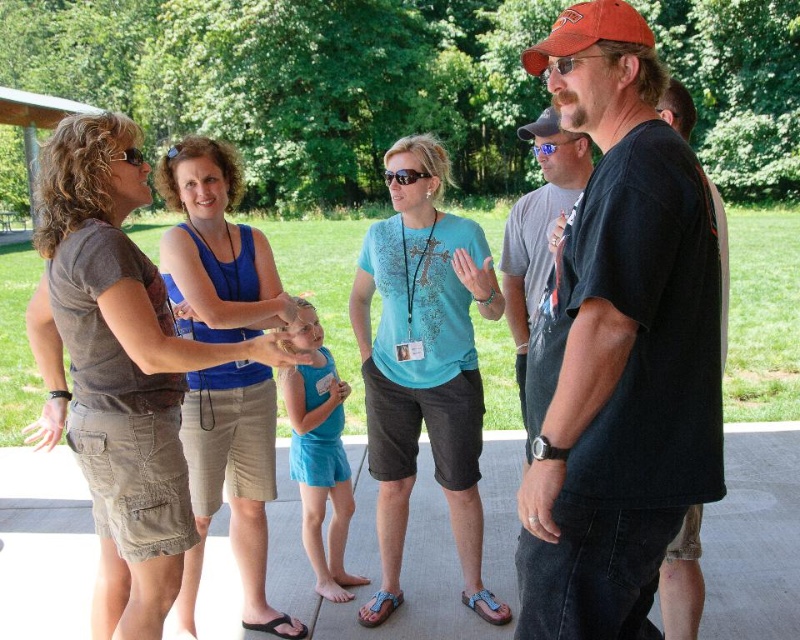
Question: Which object is the closest to the black cotton t-shirt at center?

Choices:
 (A) blue reflective lens glasses at center
 (B) gray cotton t-shirt at center

Answer: (B)

Question: Which point is closer to the camera?

Choices:
 (A) (641, 352)
 (B) (552, 140)
 (C) (524, 296)

Answer: (A)

Question: Can you confirm if black cotton t-shirt at center is wider than blue reflective lens glasses at center?

Choices:
 (A) yes
 (B) no

Answer: (B)

Question: Which object appears closest to the camera in this image?

Choices:
 (A) black cotton t-shirt at center
 (B) blue reflective lens glasses at center

Answer: (A)

Question: Where is gray cotton t-shirt at center located in relation to blue reflective lens glasses at center in the image?

Choices:
 (A) below
 (B) above

Answer: (A)

Question: Is black cotton t-shirt at center smaller than gray cotton t-shirt at center?

Choices:
 (A) yes
 (B) no

Answer: (A)